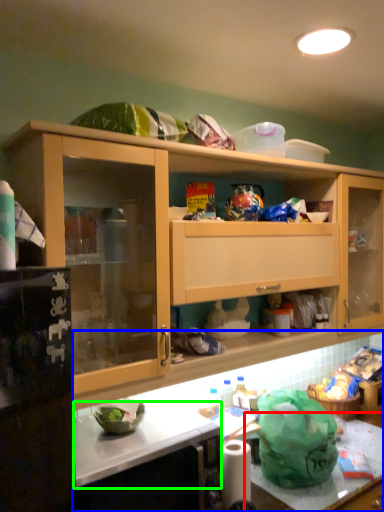
Question: Which object is the closest to the counter top (highlighted by a red box)? Choose among these: countertop (highlighted by a blue box) or counter top (highlighted by a green box).

Choices:
 (A) countertop
 (B) counter top

Answer: (A)